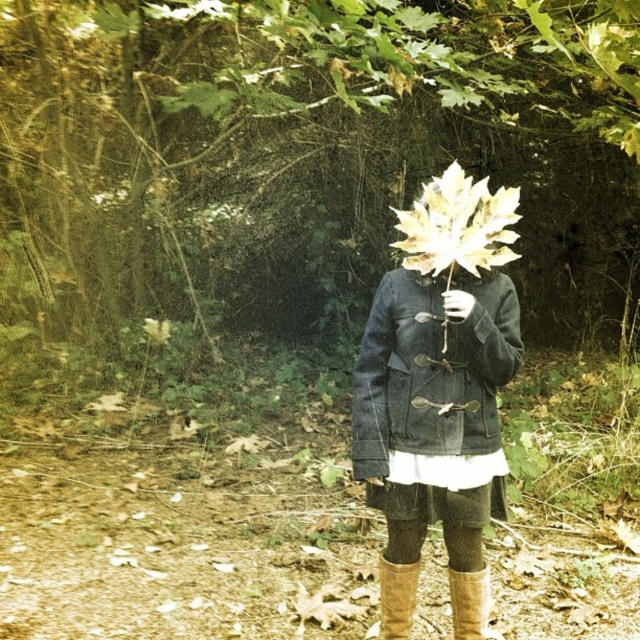
Question: Considering the real-world distances, which object is farthest from the brown suede boot at lower center?

Choices:
 (A) green leafy tree at center
 (B) matte gray coat at center

Answer: (A)

Question: Is brown suede boot at lower center below leather boots at lower center?

Choices:
 (A) yes
 (B) no

Answer: (A)

Question: Can you confirm if green leafy tree at center is positioned to the left of brown suede boot at lower center?

Choices:
 (A) yes
 (B) no

Answer: (B)

Question: Is green leafy tree at center closer to the viewer compared to leather boots at lower center?

Choices:
 (A) no
 (B) yes

Answer: (A)

Question: Based on their relative distances, which object is nearer to the green leafy tree at center?

Choices:
 (A) brown suede boot at lower center
 (B) leather boots at lower center

Answer: (A)

Question: Which of the following is the farthest from the observer?

Choices:
 (A) matte gray coat at center
 (B) leather boots at lower center

Answer: (B)